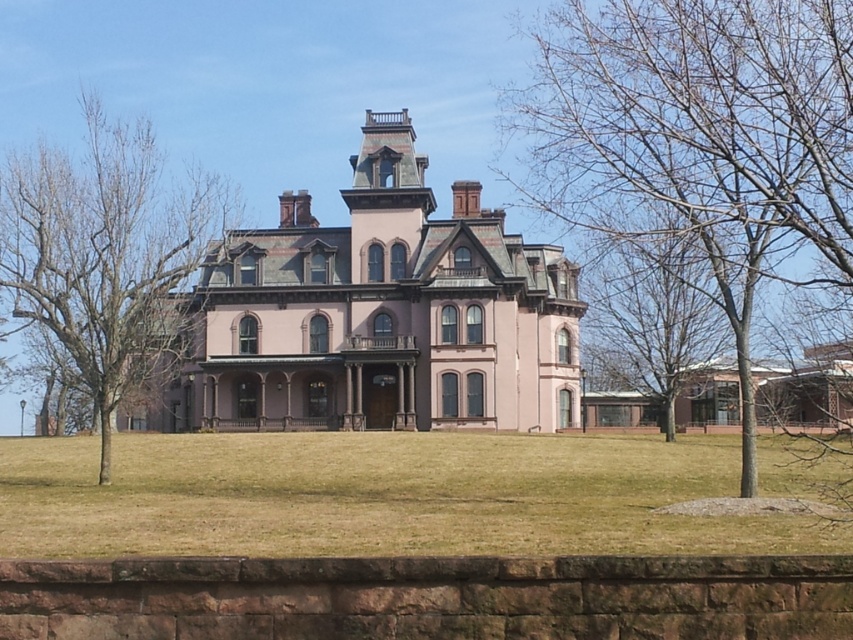
Question: Based on their relative distances, which object is farther from the pink matte mansion at center?

Choices:
 (A) bare wood tree at center
 (B) bare wood tree at left

Answer: (A)

Question: Which point is closer to the camera taking this photo?

Choices:
 (A) (138, 225)
 (B) (234, 412)
 (C) (636, 214)

Answer: (A)

Question: From the image, what is the correct spatial relationship of bare wood tree at left in relation to bare branches at right?

Choices:
 (A) below
 (B) above

Answer: (B)

Question: Does bare wood tree at center have a greater width compared to bare wood tree at left?

Choices:
 (A) yes
 (B) no

Answer: (A)

Question: Is bare wood tree at center closer to the viewer compared to bare branches at right?

Choices:
 (A) yes
 (B) no

Answer: (A)

Question: Estimate the real-world distances between objects in this image. Which object is closer to the bare wood tree at left?

Choices:
 (A) bare wood tree at center
 (B) pink matte mansion at center

Answer: (B)